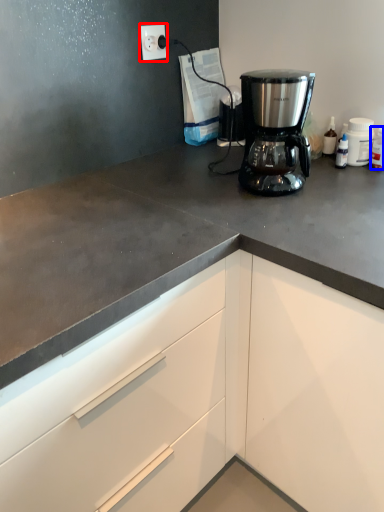
Question: Which point is closer to the camera, electric outlet (highlighted by a red box) or bottle (highlighted by a blue box)?

Choices:
 (A) electric outlet
 (B) bottle

Answer: (B)